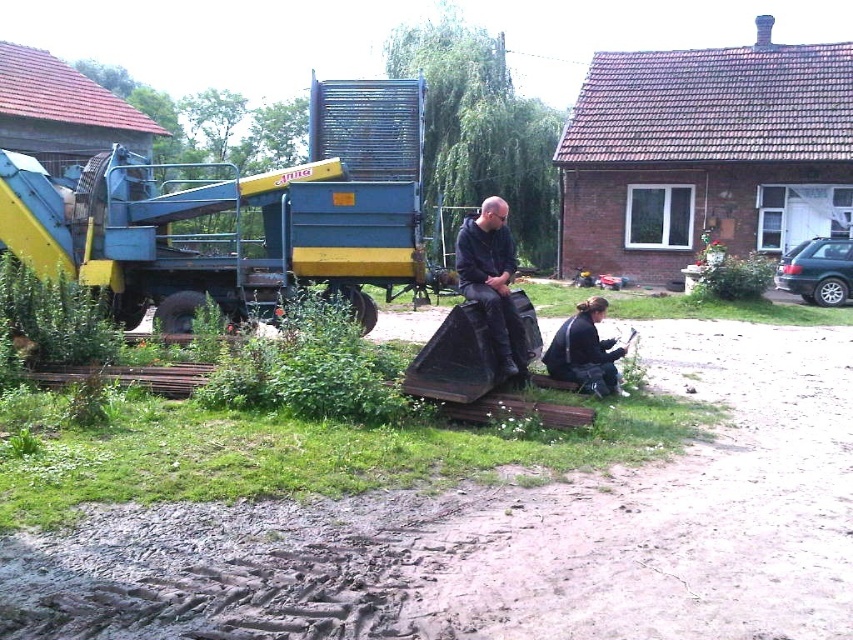
Question: Does dark blue leather jacket at center have a larger size compared to black fabric jacket at lower center?

Choices:
 (A) yes
 (B) no

Answer: (B)

Question: Does dark blue leather jacket at center have a smaller size compared to black fabric jacket at lower center?

Choices:
 (A) yes
 (B) no

Answer: (A)

Question: Which of the following is the closest to the observer?

Choices:
 (A) (556, 355)
 (B) (483, 236)

Answer: (B)

Question: Which point is closer to the camera?

Choices:
 (A) (502, 259)
 (B) (618, 349)

Answer: (A)

Question: Can you confirm if dark blue leather jacket at center is wider than black fabric jacket at lower center?

Choices:
 (A) yes
 (B) no

Answer: (B)